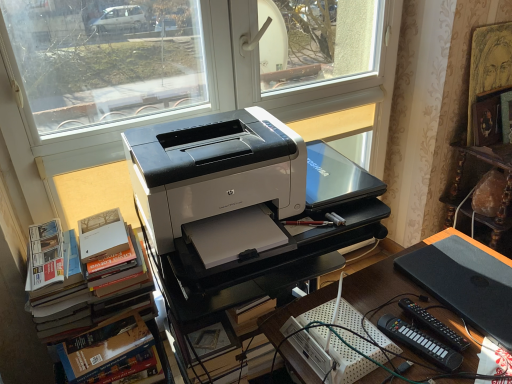
Locate an element on the screen. The height and width of the screenshot is (384, 512). vacant location below black matte laptop at lower right (from a real-world perspective) is located at coordinates (467, 279).